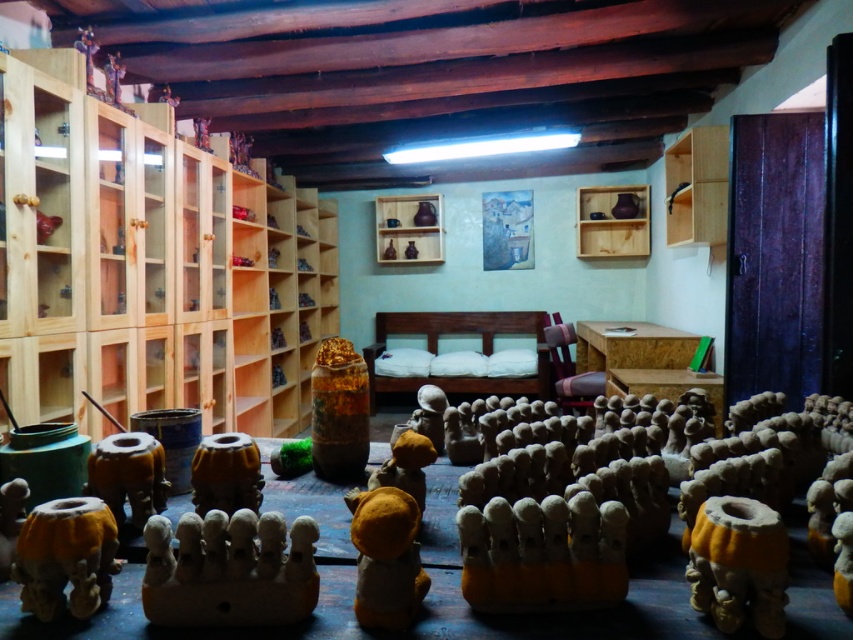
Can you confirm if matte yellow clay toy at lower left is positioned to the left of matte brown vase at center?

Correct, you'll find matte yellow clay toy at lower left to the left of matte brown vase at center.

At what (x,y) coordinates should I click in order to perform the action: click on matte yellow clay toy at lower left. Please return your answer as a coordinate pair (x, y). Looking at the image, I should click on (67, 557).

Is wooden shelf at upper right shorter than matte brown vase at center?

No.

Which is in front, point (682, 221) or point (218, 458)?

Point (218, 458)

Between point (688, 134) and point (219, 488), which one is positioned in front?

Positioned in front is point (219, 488).

This screenshot has height=640, width=853. In order to click on wooden shelf at upper right in this screenshot , I will do tap(695, 188).

Does wooden shelf at upper center have a greater height compared to matte wood shelf at center?

Incorrect, wooden shelf at upper center's height is not larger of matte wood shelf at center's.

Does wooden shelf at upper center appear under matte wood shelf at center?

Incorrect, wooden shelf at upper center is not positioned below matte wood shelf at center.

Between point (636, 246) and point (421, 211), which one is positioned behind?

The point (421, 211) is behind.

The height and width of the screenshot is (640, 853). What are the coordinates of `wooden shelf at upper center` in the screenshot? It's located at (613, 221).